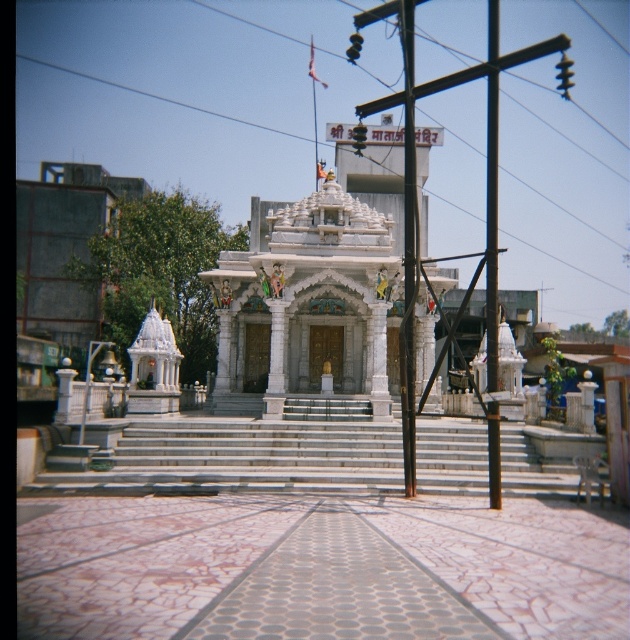
You are standing at the base of the white marble hindu temple at center. You want to take a photo of the temple from a distance that allows you to capture the entire structure in the frame. Considering the temple is 72.37 meters away from the camera, would you need to use a wide angle lens or a telephoto lens?

Since the white marble hindu temple at center is 72.37 meters away from the camera, you would need to use a wide angle lens to capture the entire structure in the frame because wide angle lenses are designed to capture a broader field of view, allowing you to include the entire temple when it is far away.